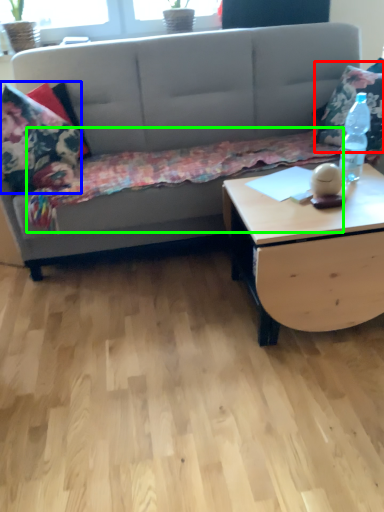
Question: Which is nearer to the throw pillow (highlighted by a red box)? pillow (highlighted by a blue box) or blanket (highlighted by a green box).

Choices:
 (A) pillow
 (B) blanket

Answer: (B)